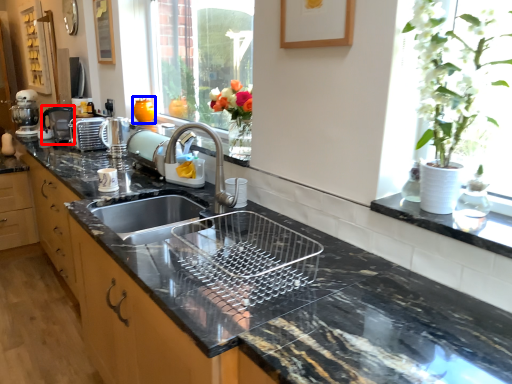
Question: Which object is further to the camera taking this photo, coffee machine (highlighted by a red box) or vase (highlighted by a blue box)?

Choices:
 (A) coffee machine
 (B) vase

Answer: (A)